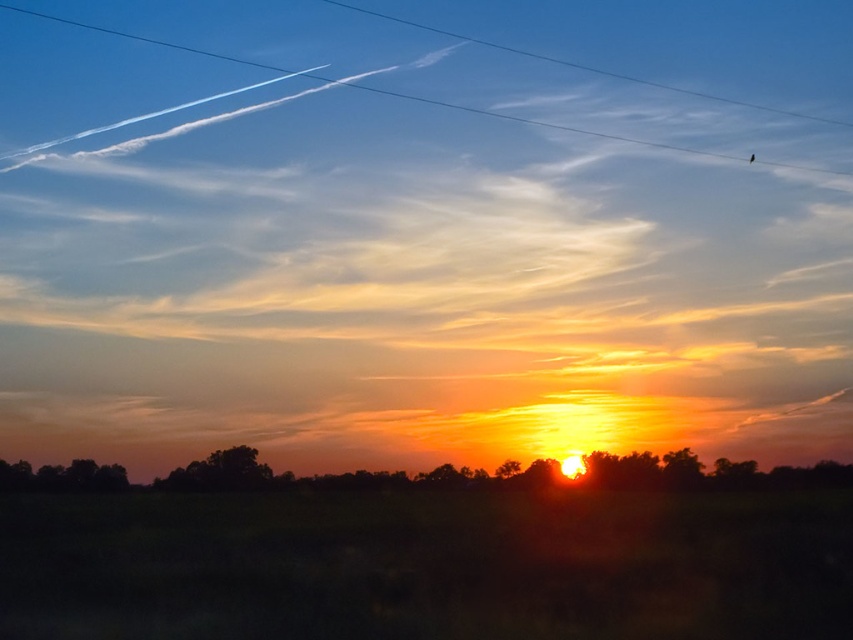
You are standing at the point with coordinates [341,476] in the image. What object is located exactly at your current position?

The silhouetted trees at center are located at point [341,476].